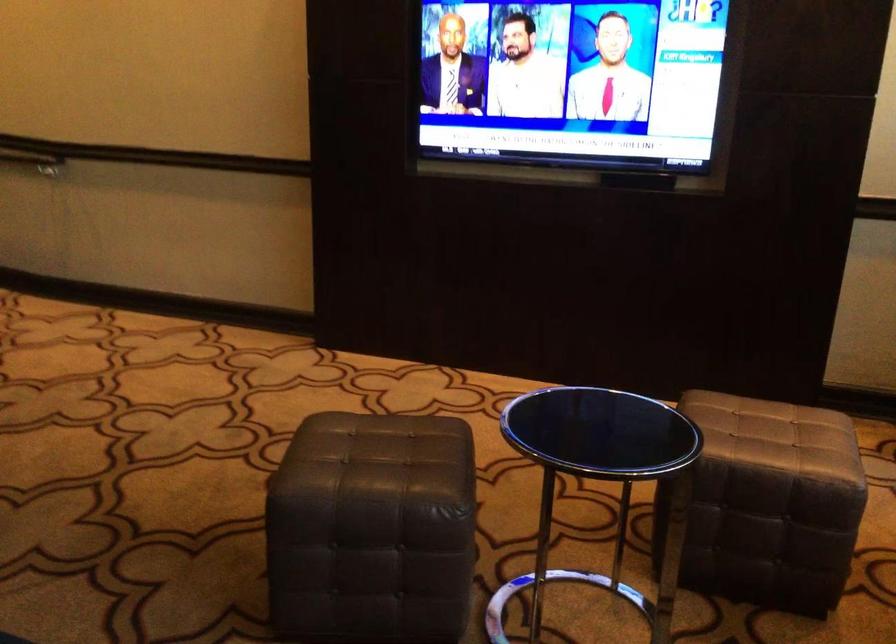
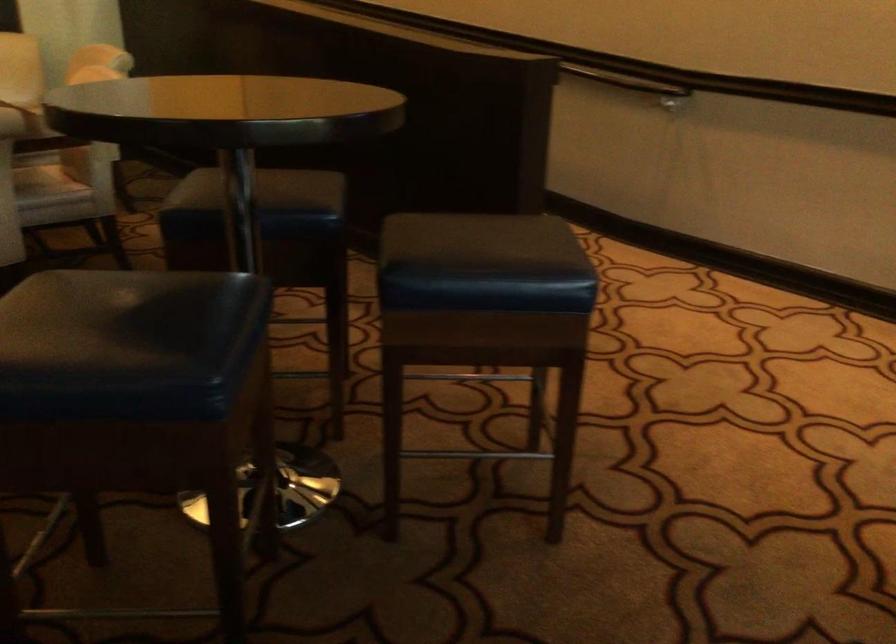
Which direction would the cameraman need to move to produce the second image?

The cameraman moved toward left, forward.